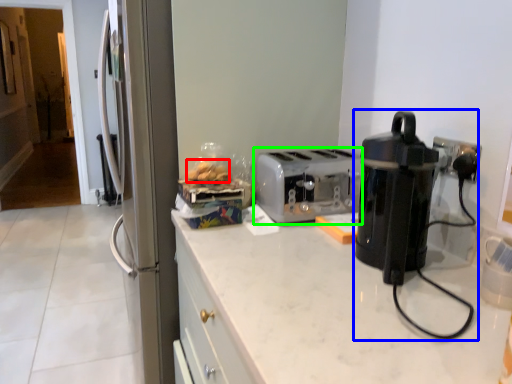
Question: Which is nearer to the food (highlighted by a red box)? home appliance (highlighted by a blue box) or toaster (highlighted by a green box).

Choices:
 (A) home appliance
 (B) toaster

Answer: (B)